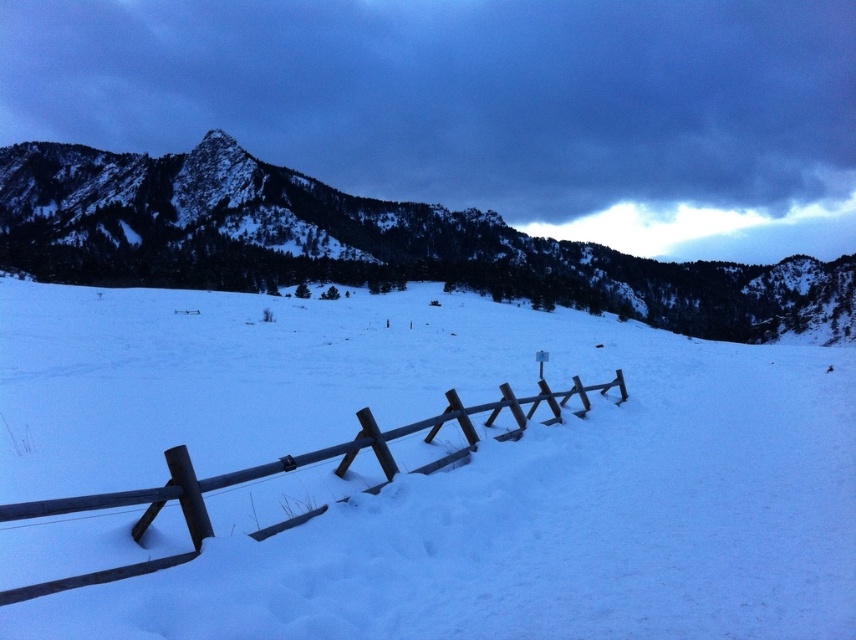
Does white matte snow at center have a smaller size compared to brown wooden fence at lower center?

No, white matte snow at center is not smaller than brown wooden fence at lower center.

Which of these two, white matte snow at center or brown wooden fence at lower center, stands shorter?

With less height is brown wooden fence at lower center.

Which is in front, point (788, 529) or point (3, 516)?

Point (3, 516) is more forward.

The width and height of the screenshot is (856, 640). I want to click on white matte snow at center, so click(443, 474).

You are a GUI agent. You are given a task and a screenshot of the screen. Output one action in this format:
    pyautogui.click(x=<x>, y=<y>)
    Task: Click on the snowy rocky mountain at upper left
    This screenshot has width=856, height=640.
    Given the screenshot: What is the action you would take?
    pyautogui.click(x=364, y=243)

Is snowy rocky mountain at upper left thinner than brown wooden fence at lower center?

Incorrect, snowy rocky mountain at upper left's width is not less than brown wooden fence at lower center's.

Is point (194, 259) behind point (223, 481)?

Yes, it is behind point (223, 481).

This screenshot has width=856, height=640. Identify the location of snowy rocky mountain at upper left. (364, 243).

Does point (409, 400) come behind point (682, 291)?

That is False.

Where is `white matte snow at center`? Image resolution: width=856 pixels, height=640 pixels. white matte snow at center is located at coordinates tap(443, 474).